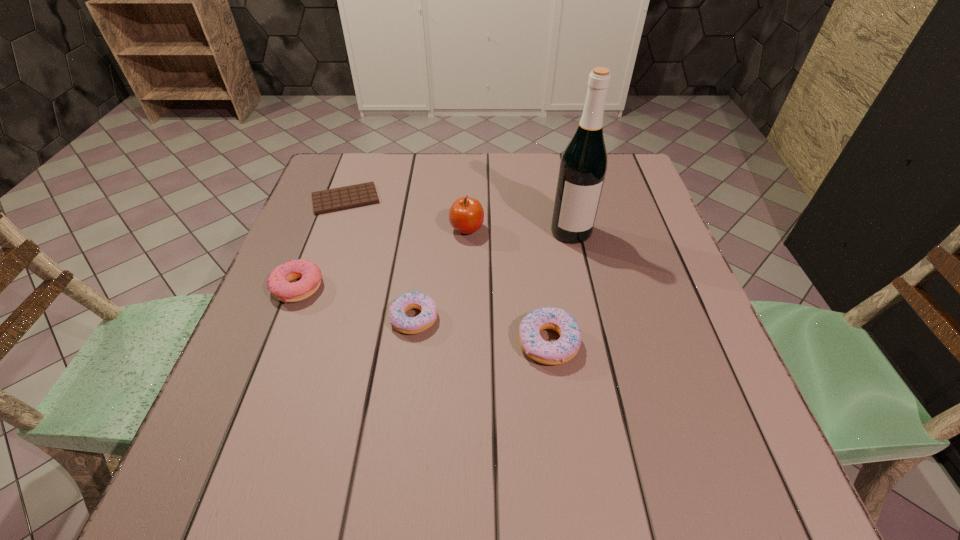
At what (x,y) coordinates should I click in order to perform the action: click on blank area located on the back of the fourth shortest object. Please return your answer as a coordinate pair (x, y). Image resolution: width=960 pixels, height=540 pixels. Looking at the image, I should click on (541, 288).

The width and height of the screenshot is (960, 540). I want to click on vacant space located on the front of the fifth shortest object, so click(463, 369).

Where is `vacant position located on the label of the wine bottle`? The width and height of the screenshot is (960, 540). vacant position located on the label of the wine bottle is located at coordinates (593, 333).

Find the location of a particular element. This screenshot has width=960, height=540. vacant space situated on the front of the farthest object is located at coordinates (332, 238).

This screenshot has width=960, height=540. What are the coordinates of `free space located on the back of the leftmost doughnut` in the screenshot? It's located at (333, 197).

This screenshot has width=960, height=540. Find the location of `object located at the far edge`. object located at the far edge is located at coordinates (342, 198).

Image resolution: width=960 pixels, height=540 pixels. What are the coordinates of `chocolate bar that is at the left edge` in the screenshot? It's located at (342, 198).

Find the location of `doughnut located at the left edge`. doughnut located at the left edge is located at coordinates (278, 283).

At what (x,y) coordinates should I click in order to perform the action: click on object present at the far left corner. Please return your answer as a coordinate pair (x, y). Image resolution: width=960 pixels, height=540 pixels. Looking at the image, I should click on (342, 198).

Identify the location of free region at the far edge. (396, 156).